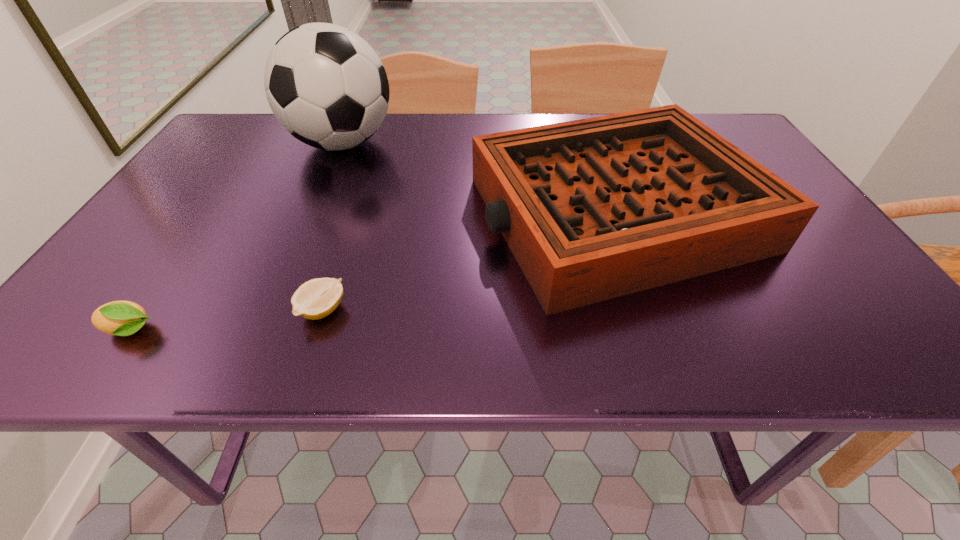
Where is `vacant area that lies between the leftmost object and the soccer ball`? This screenshot has width=960, height=540. vacant area that lies between the leftmost object and the soccer ball is located at coordinates (236, 237).

Locate an element on the screen. vacant region between the left lemon and the rightmost object is located at coordinates (373, 272).

Locate an element on the screen. The height and width of the screenshot is (540, 960). object that is the second closest to the gameboard is located at coordinates (315, 299).

Point out which object is positioned as the third nearest to the soccer ball. Please provide its 2D coordinates. Your answer should be formatted as a tuple, i.e. [(x, y)], where the tuple contains the x and y coordinates of a point satisfying the conditions above.

[(121, 318)]

Locate an element on the screen. vacant area in the image that satisfies the following two spatial constraints: 1. on the front side of the rightmost object; 2. with leaves positioned above the taller lemon is located at coordinates (658, 331).